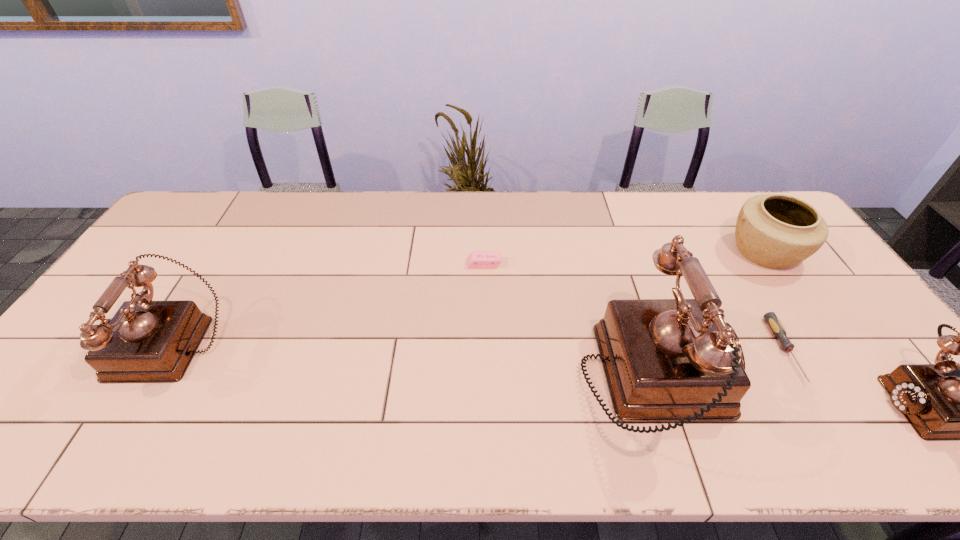
The height and width of the screenshot is (540, 960). I want to click on object present at the far edge, so click(777, 231).

Image resolution: width=960 pixels, height=540 pixels. Find the location of `screwdriver that is positioned at the near edge`. screwdriver that is positioned at the near edge is located at coordinates (x=771, y=319).

The image size is (960, 540). In order to click on object at the left edge in this screenshot , I will do `click(146, 341)`.

I want to click on object present at the right edge, so click(777, 231).

Locate an element on the screen. This screenshot has width=960, height=540. object situated at the near left corner is located at coordinates (146, 341).

Locate an element on the screen. object located in the far right corner section of the desktop is located at coordinates (777, 231).

In the image, there is a desktop. Identify the location of free space at the far edge. This screenshot has width=960, height=540. (360, 202).

The width and height of the screenshot is (960, 540). In order to click on vacant space at the near edge of the desktop in this screenshot , I will do `click(464, 389)`.

Where is `free space at the left edge`? This screenshot has height=540, width=960. free space at the left edge is located at coordinates (88, 371).

Find the location of a particular element. This screenshot has height=540, width=960. blank space at the right edge of the desktop is located at coordinates (832, 321).